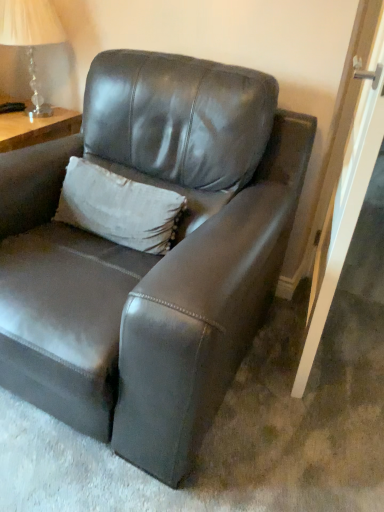
Question: From a real-world perspective, relative to matte leather couch at center, is white textured pillow at upper center vertically above or below?

Choices:
 (A) below
 (B) above

Answer: (B)

Question: In the image, is white textured pillow at upper center on the left side or the right side of matte leather couch at center?

Choices:
 (A) left
 (B) right

Answer: (A)

Question: Estimate the real-world distances between objects in this image. Which object is closer to the clear glass lamp at upper left?

Choices:
 (A) white textured pillow at upper center
 (B) matte leather couch at center

Answer: (A)

Question: Which object is positioned closest to the white textured pillow at upper center?

Choices:
 (A) clear glass lamp at upper left
 (B) matte leather couch at center

Answer: (B)